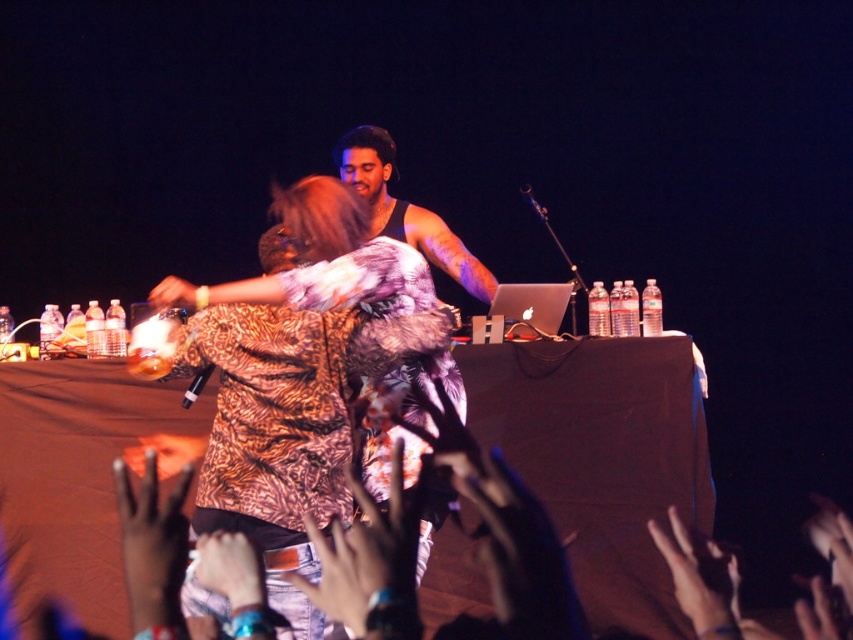
Where is `leopard print shirt at center`? This screenshot has height=640, width=853. leopard print shirt at center is located at coordinates (308, 378).

Who is more forward, (219, 294) or (190, 285)?

Point (219, 294) is more forward.

The width and height of the screenshot is (853, 640). I want to click on leopard print shirt at center, so 308,378.

Who is more distant from viewer, (693,596) or (529,196)?

The point (529,196) is behind.

Does smooth skin hand at center have a lesser height compared to metallic silver microphone at center?

Correct, smooth skin hand at center is not as tall as metallic silver microphone at center.

Does point (683, 604) lie behind point (531, 189)?

No.

You are a GUI agent. You are given a task and a screenshot of the screen. Output one action in this format:
    pyautogui.click(x=<x>, y=<y>)
    Task: Click on the smooth skin hand at center
    
    Given the screenshot: What is the action you would take?
    pyautogui.click(x=698, y=577)

Is smooth skin hand at center above black plastic microphone at center?

Actually, smooth skin hand at center is below black plastic microphone at center.

Which is more to the right, smooth skin hand at center or black plastic microphone at center?

smooth skin hand at center is more to the right.

The image size is (853, 640). Find the location of `smooth skin hand at center`. smooth skin hand at center is located at coordinates (698, 577).

Where is `smooth skin hand at center`? Image resolution: width=853 pixels, height=640 pixels. smooth skin hand at center is located at coordinates (698, 577).